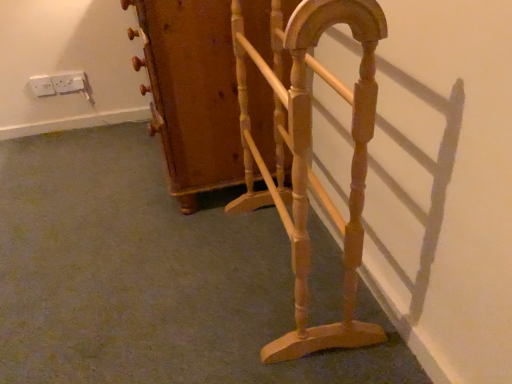
Question: Does white plastic socket at upper left, which is the 2th electric outlet in right-to-left order, turn towards white plastic socket at upper left, the first electric outlet in the right-to-left sequence?

Choices:
 (A) no
 (B) yes

Answer: (A)

Question: Considering the relative positions of white plastic socket at upper left, which is counted as the first electric outlet, starting from the left, and white plastic socket at upper left, the first electric outlet in the right-to-left sequence, in the image provided, is white plastic socket at upper left, which is counted as the first electric outlet, starting from the left, to the right of white plastic socket at upper left, the first electric outlet in the right-to-left sequence, from the viewer's perspective?

Choices:
 (A) yes
 (B) no

Answer: (B)

Question: Considering the relative sizes of white plastic socket at upper left, which is counted as the first electric outlet, starting from the left, and white plastic socket at upper left, the first electric outlet in the right-to-left sequence, in the image provided, is white plastic socket at upper left, which is counted as the first electric outlet, starting from the left, bigger than white plastic socket at upper left, the first electric outlet in the right-to-left sequence,?

Choices:
 (A) no
 (B) yes

Answer: (A)

Question: Can you confirm if white plastic socket at upper left, which is the 2th electric outlet in right-to-left order, is wider than white plastic socket at upper left, the first electric outlet in the right-to-left sequence?

Choices:
 (A) yes
 (B) no

Answer: (B)

Question: From the image's perspective, is white plastic socket at upper left, which is the 2th electric outlet in right-to-left order, below white plastic socket at upper left, which is the 2th electric outlet in left-to-right order?

Choices:
 (A) yes
 (B) no

Answer: (A)

Question: From a real-world perspective, does white plastic socket at upper left, which is the 2th electric outlet in right-to-left order, sit lower than white plastic socket at upper left, which is the 2th electric outlet in left-to-right order?

Choices:
 (A) no
 (B) yes

Answer: (A)

Question: Can you see light brown wood magazine rack at center, the first furniture when ordered from front to back, touching wooden coat rack at center, positioned as the 1th furniture in back-to-front order?

Choices:
 (A) yes
 (B) no

Answer: (B)

Question: From the image's perspective, is light brown wood magazine rack at center, the first furniture when ordered from front to back, above wooden coat rack at center, the 2th furniture in the front-to-back sequence?

Choices:
 (A) no
 (B) yes

Answer: (A)

Question: Is light brown wood magazine rack at center, which is counted as the 2th furniture, starting from the back, smaller than wooden coat rack at center, the 2th furniture in the front-to-back sequence?

Choices:
 (A) no
 (B) yes

Answer: (B)

Question: From a real-world perspective, is light brown wood magazine rack at center, the first furniture when ordered from front to back, positioned over wooden coat rack at center, the 2th furniture in the front-to-back sequence, based on gravity?

Choices:
 (A) no
 (B) yes

Answer: (B)

Question: Is light brown wood magazine rack at center, the first furniture when ordered from front to back, not close to wooden coat rack at center, the 2th furniture in the front-to-back sequence?

Choices:
 (A) no
 (B) yes

Answer: (A)

Question: Is light brown wood magazine rack at center, the first furniture when ordered from front to back, thinner than wooden coat rack at center, the 2th furniture in the front-to-back sequence?

Choices:
 (A) yes
 (B) no

Answer: (A)

Question: From the image's perspective, is white plastic socket at upper left, which is the 2th electric outlet in left-to-right order, beneath light brown wood magazine rack at center, the first furniture when ordered from front to back?

Choices:
 (A) no
 (B) yes

Answer: (A)